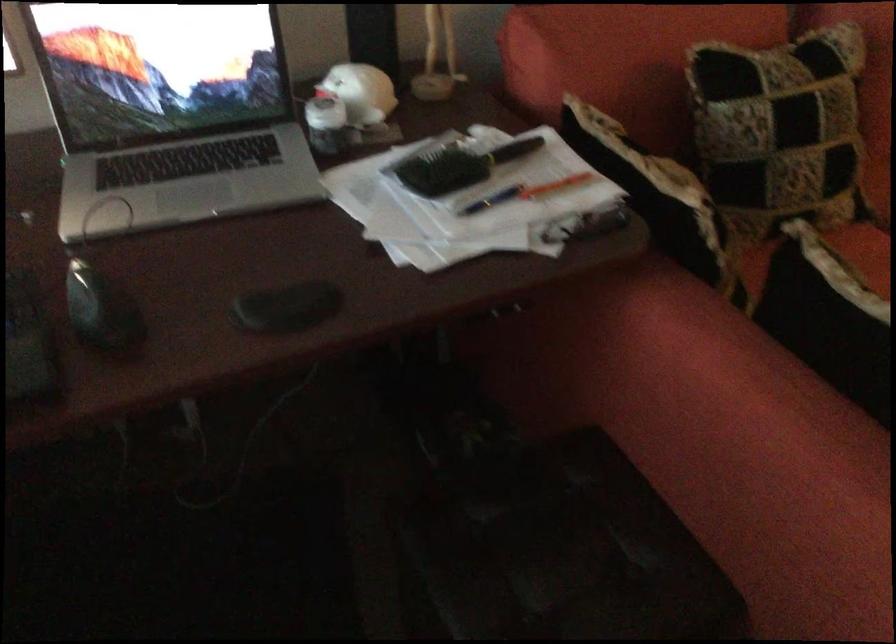
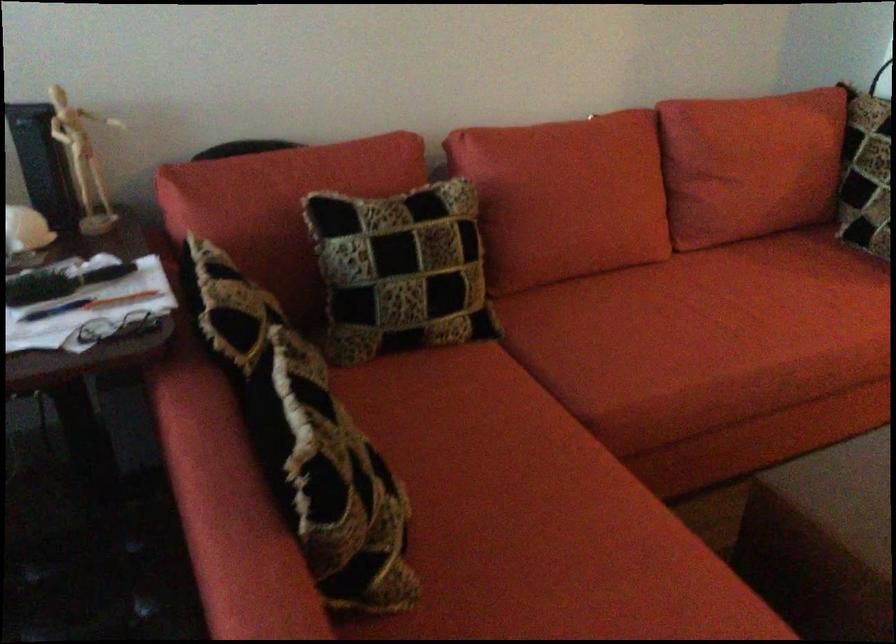
The point at (x=570, y=214) is marked in the first image. Where is the corresponding point in the second image?

(119, 328)